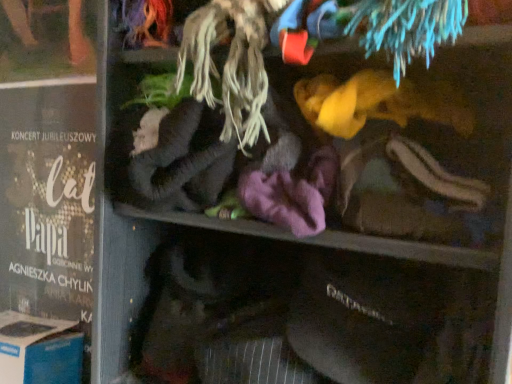
The width and height of the screenshot is (512, 384). Find the location of `free space above blue cardboard box at lower left (from a real-world perspective)`. free space above blue cardboard box at lower left (from a real-world perspective) is located at coordinates (26, 327).